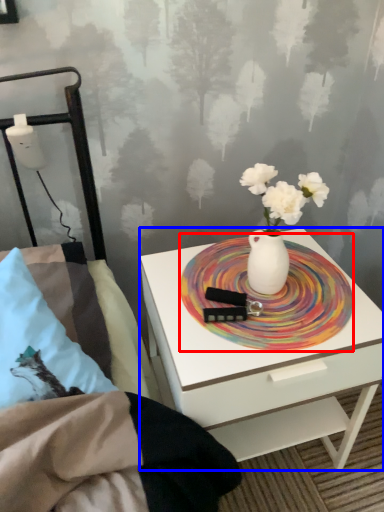
Question: Among these objects, which one is farthest to the camera, platter (highlighted by a red box) or nightstand (highlighted by a blue box)?

Choices:
 (A) platter
 (B) nightstand

Answer: (A)